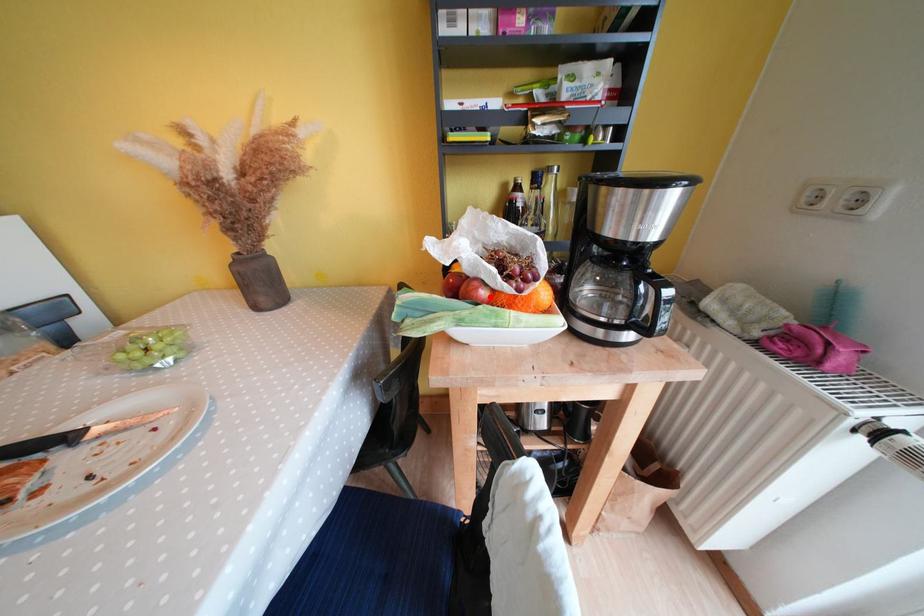
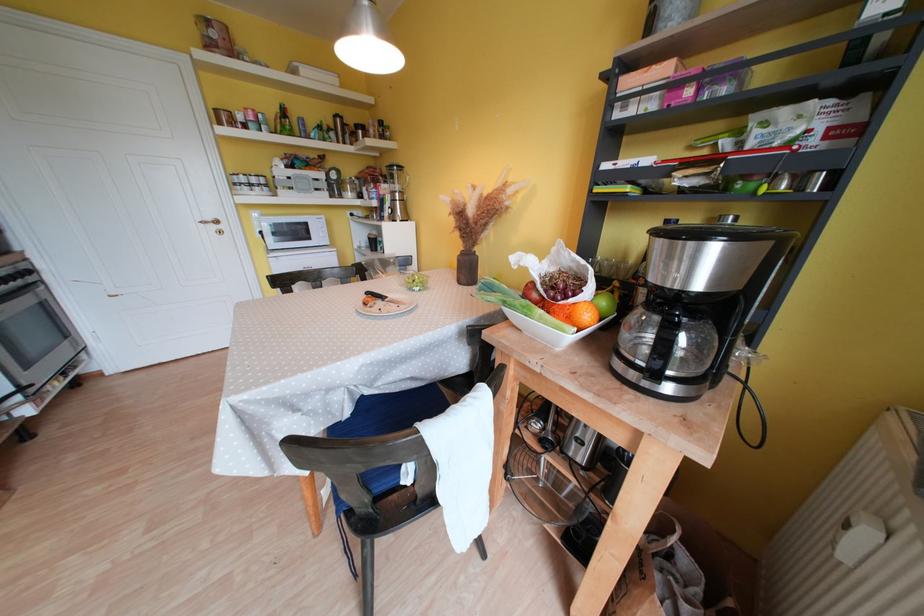
Where in the second image is the point corresponding to the highlighted location from the first image?

(541, 299)